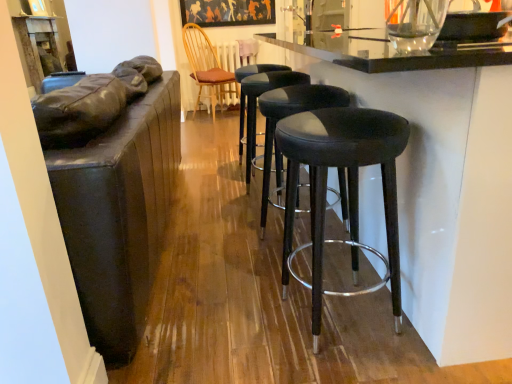
Question: Could you tell me if matte black stool at center, acting as the third stool starting from the back, is turned towards black leather stool at center, marked as the third stool in a front-to-back arrangement?

Choices:
 (A) no
 (B) yes

Answer: (A)

Question: Does matte black stool at center, acting as the third stool starting from the back, lie in front of black leather stool at center, marked as the third stool in a front-to-back arrangement?

Choices:
 (A) no
 (B) yes

Answer: (B)

Question: Considering the relative sizes of matte black stool at center, the 1th stool viewed from the front, and black leather stool at center, the first stool when ordered from back to front, in the image provided, is matte black stool at center, the 1th stool viewed from the front, wider than black leather stool at center, the first stool when ordered from back to front,?

Choices:
 (A) no
 (B) yes

Answer: (B)

Question: From a real-world perspective, does matte black stool at center, acting as the third stool starting from the back, sit lower than black leather stool at center, the first stool when ordered from back to front?

Choices:
 (A) no
 (B) yes

Answer: (A)

Question: Is matte black stool at center, the 1th stool viewed from the front, oriented away from black leather stool at center, the first stool when ordered from back to front?

Choices:
 (A) no
 (B) yes

Answer: (A)

Question: From a real-world perspective, does matte black stool at center, acting as the third stool starting from the back, stand above black leather stool at center, marked as the third stool in a front-to-back arrangement?

Choices:
 (A) no
 (B) yes

Answer: (B)

Question: Does black leather stool at center, marked as the third stool in a front-to-back arrangement, appear on the left side of matte black frame at upper center?

Choices:
 (A) no
 (B) yes

Answer: (A)

Question: Does black leather stool at center, marked as the third stool in a front-to-back arrangement, have a lesser height compared to matte black frame at upper center?

Choices:
 (A) yes
 (B) no

Answer: (B)

Question: Could you tell me if black leather stool at center, the first stool when ordered from back to front, is turned towards matte black frame at upper center?

Choices:
 (A) no
 (B) yes

Answer: (A)

Question: Is black leather stool at center, the first stool when ordered from back to front, thinner than matte black frame at upper center?

Choices:
 (A) yes
 (B) no

Answer: (B)

Question: Can you confirm if black leather stool at center, the first stool when ordered from back to front, is bigger than matte black frame at upper center?

Choices:
 (A) yes
 (B) no

Answer: (A)

Question: Is the depth of black leather stool at center, the first stool when ordered from back to front, greater than that of matte black frame at upper center?

Choices:
 (A) yes
 (B) no

Answer: (B)

Question: Is matte black frame at upper center at the right side of black leather stool at center, marked as the third stool in a front-to-back arrangement?

Choices:
 (A) yes
 (B) no

Answer: (B)